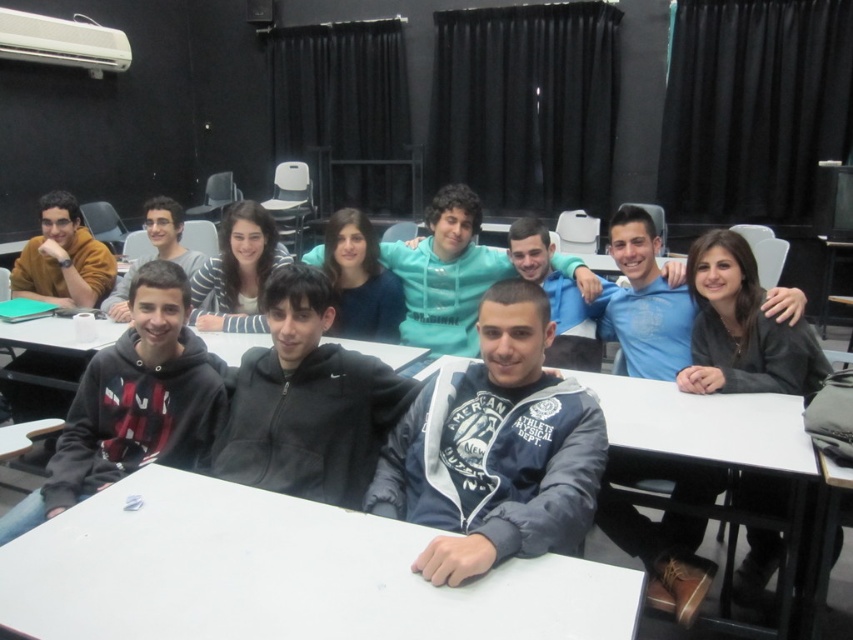
Question: Can you confirm if white matte table at center is positioned to the right of striped fabric shirt at center?

Choices:
 (A) no
 (B) yes

Answer: (B)

Question: Which point appears closest to the camera in this image?

Choices:
 (A) (131, 291)
 (B) (769, 381)

Answer: (A)

Question: Is blue fabric jacket at center positioned in front of dark gray sweater at center?

Choices:
 (A) no
 (B) yes

Answer: (B)

Question: Which object is the closest to the blue fabric jacket at center?

Choices:
 (A) dark gray sweater at center
 (B) striped fabric shirt at center
 (C) black fleece hoodie at left
 (D) white matte table at center

Answer: (D)

Question: Which point appears farthest from the camera in this image?

Choices:
 (A) (463, 460)
 (B) (784, 506)
 (C) (260, 225)

Answer: (C)

Question: Is black fleece hoodie at left thinner than striped fabric shirt at center?

Choices:
 (A) no
 (B) yes

Answer: (A)